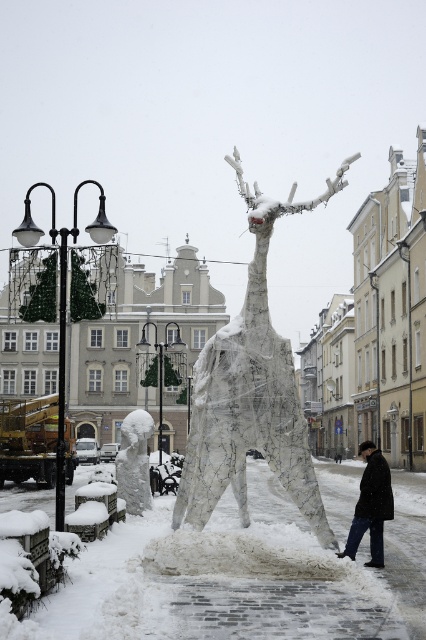
Question: Estimate the real-world distances between objects in this image. Which object is farther from the white frosty statue at lower left?

Choices:
 (A) black wool coat at lower center
 (B) white wire mesh reindeer at center

Answer: (A)

Question: Which object is farther from the camera taking this photo?

Choices:
 (A) black wool coat at lower center
 (B) white wire mesh reindeer at center

Answer: (B)

Question: Does black wool coat at lower center appear over white frosty statue at lower left?

Choices:
 (A) yes
 (B) no

Answer: (B)

Question: Can you confirm if black wool coat at lower center is bigger than white frosty statue at lower left?

Choices:
 (A) yes
 (B) no

Answer: (A)

Question: Which point is closer to the camera?

Choices:
 (A) black wool coat at lower center
 (B) white frosty statue at lower left

Answer: (A)

Question: Is white wire mesh reindeer at center to the left of black wool coat at lower center from the viewer's perspective?

Choices:
 (A) no
 (B) yes

Answer: (B)